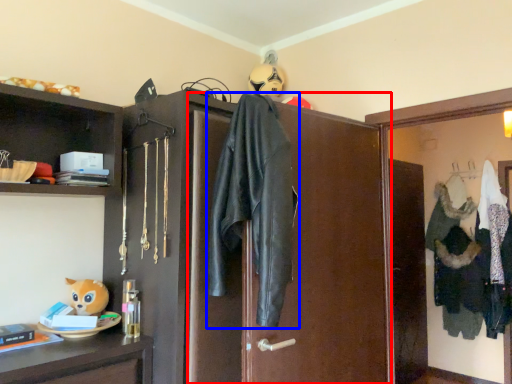
Question: Which object is closer to the camera taking this photo, screen door (highlighted by a red box) or jacket (highlighted by a blue box)?

Choices:
 (A) screen door
 (B) jacket

Answer: (B)